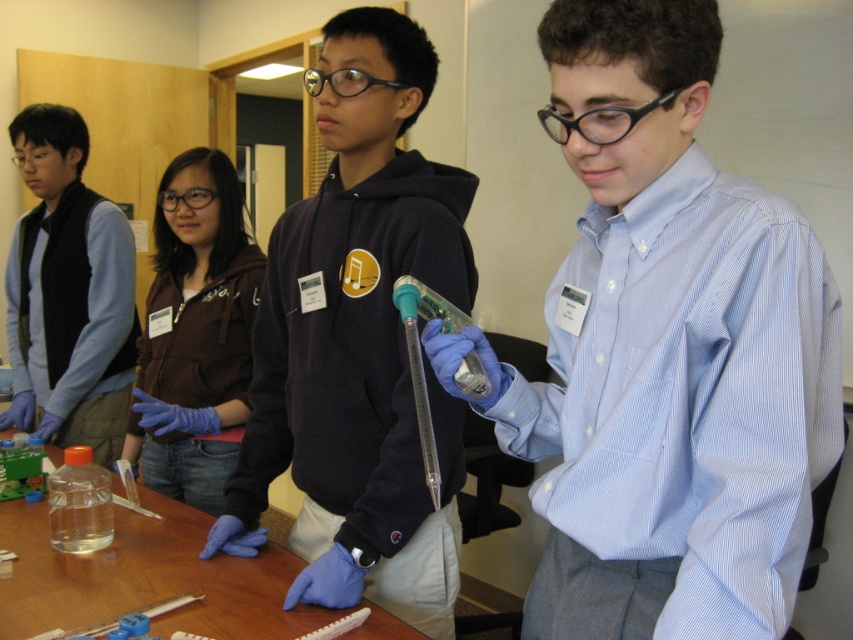
Can you confirm if brown soft jacket at center is positioned above transparent plastic table at center?

Indeed, brown soft jacket at center is positioned over transparent plastic table at center.

Is brown soft jacket at center thinner than transparent plastic table at center?

Indeed, brown soft jacket at center has a lesser width compared to transparent plastic table at center.

Does point (196, 364) come in front of point (16, 604)?

No, (196, 364) is further to viewer.

Locate an element on the screen. This screenshot has height=640, width=853. brown soft jacket at center is located at coordinates (195, 333).

Does black matte hoodie at center have a greater height compared to brown soft jacket at center?

Yes.

Between black matte hoodie at center and brown soft jacket at center, which one has less height?

Standing shorter between the two is brown soft jacket at center.

I want to click on black matte hoodie at center, so coord(358,342).

Is blue glossy shirt at center closer to camera compared to black matte hoodie at center?

Yes.

Which is behind, point (646, 516) or point (345, 131)?

Point (345, 131)

The image size is (853, 640). In order to click on blue glossy shirt at center in this screenshot , I will do (x=665, y=353).

Image resolution: width=853 pixels, height=640 pixels. I want to click on blue glossy shirt at center, so click(665, 353).